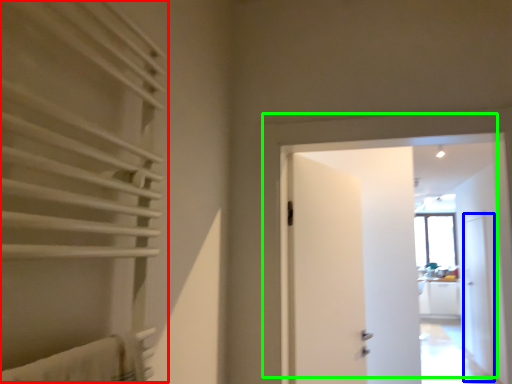
Question: Considering the real-world distances, which object is farthest from curtain (highlighted by a red box)? screen door (highlighted by a blue box) or door (highlighted by a green box)?

Choices:
 (A) screen door
 (B) door

Answer: (A)